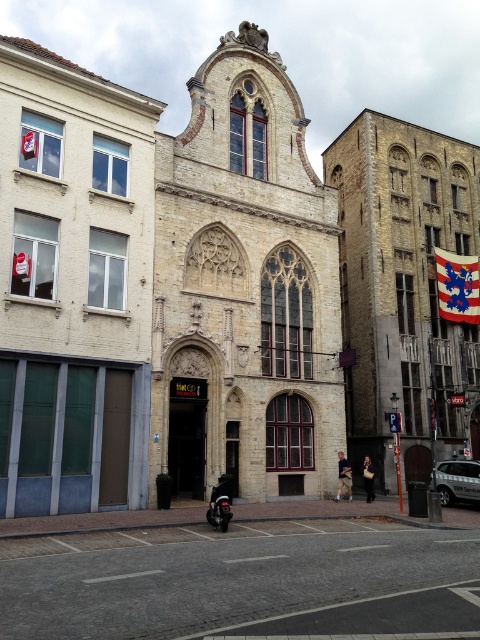
Question: Is the position of beige stone church at center less distant than that of yellow brick church at center?

Choices:
 (A) yes
 (B) no

Answer: (A)

Question: Based on their relative distances, which object is nearer to the yellow brick church at center?

Choices:
 (A) beige stone church at center
 (B) dark gray leather jacket at center

Answer: (A)

Question: Does beige stone church at center have a lesser width compared to dark gray leather jacket at center?

Choices:
 (A) no
 (B) yes

Answer: (A)

Question: Which object appears closest to the camera in this image?

Choices:
 (A) dark gray leather jacket at center
 (B) blue felt flag at upper right

Answer: (A)

Question: Which object appears closest to the camera in this image?

Choices:
 (A) yellow brick church at center
 (B) blue felt flag at upper right
 (C) shiny black motorcycle at center

Answer: (C)

Question: Considering the relative positions of beige stone church at center and shiny black motorcycle at center in the image provided, where is beige stone church at center located with respect to shiny black motorcycle at center?

Choices:
 (A) right
 (B) left

Answer: (A)